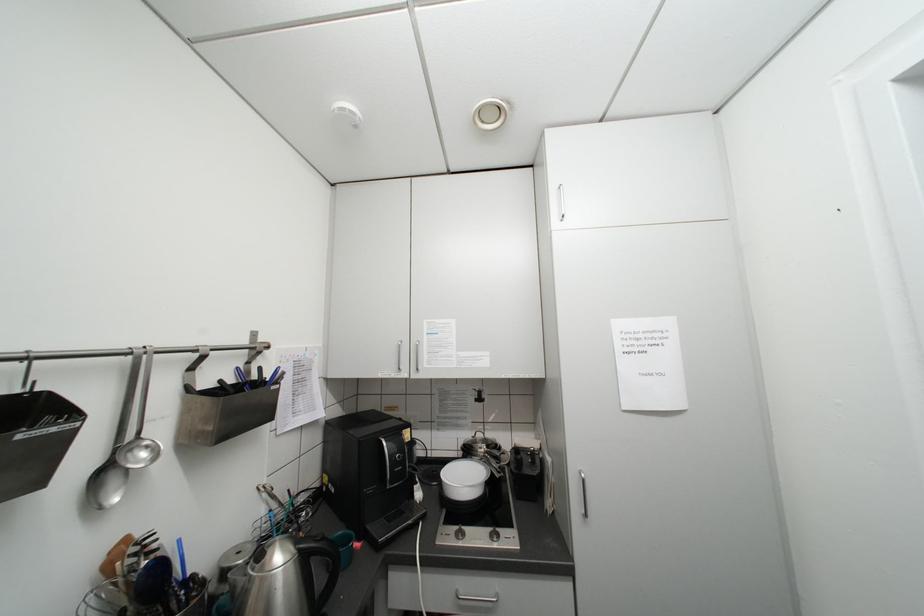
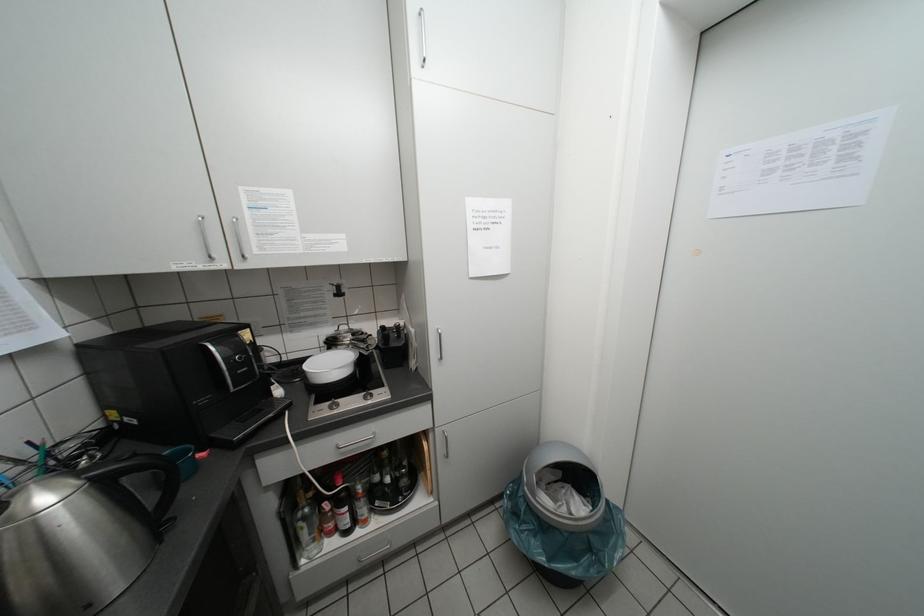
First-person continuous shooting, in which direction is the camera rotating?

The camera rotated toward right-down.